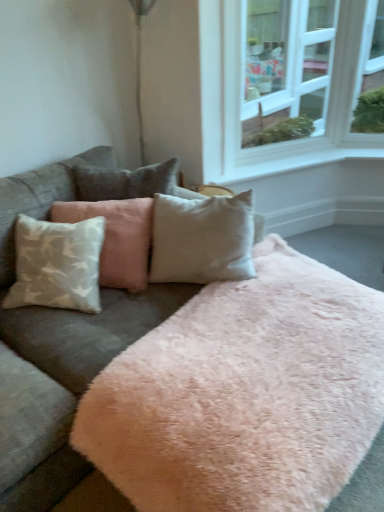
Question: Considering their positions, is white smooth window sill at center located in front of or behind velvet gray couch at center?

Choices:
 (A) behind
 (B) front

Answer: (A)

Question: Visually, is white smooth window sill at center positioned to the left or to the right of velvet gray couch at center?

Choices:
 (A) right
 (B) left

Answer: (A)

Question: Which object is positioned farthest from the velvet gray couch at center?

Choices:
 (A) white textured pillow at left
 (B) white smooth window sill at center
 (C) white glass window at upper right

Answer: (C)

Question: Estimate the real-world distances between objects in this image. Which object is closer to the velvet gray couch at center?

Choices:
 (A) white textured pillow at left
 (B) white glass window at upper right
 (C) white smooth window sill at center

Answer: (A)